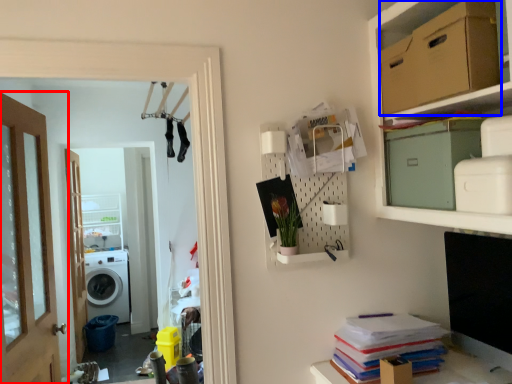
Question: Which of the following is the closest to the observer, door (highlighted by a red box) or cardboard box (highlighted by a blue box)?

Choices:
 (A) door
 (B) cardboard box

Answer: (B)